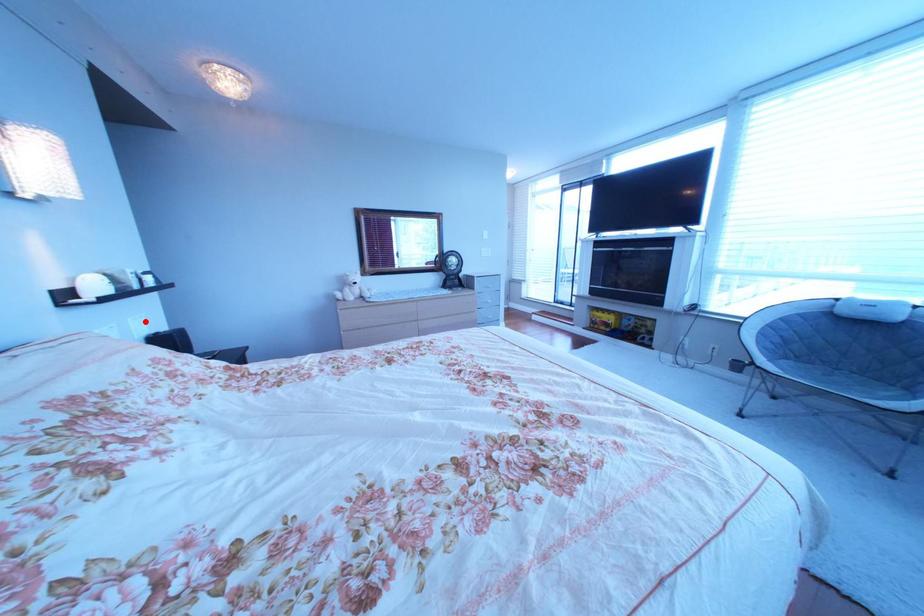
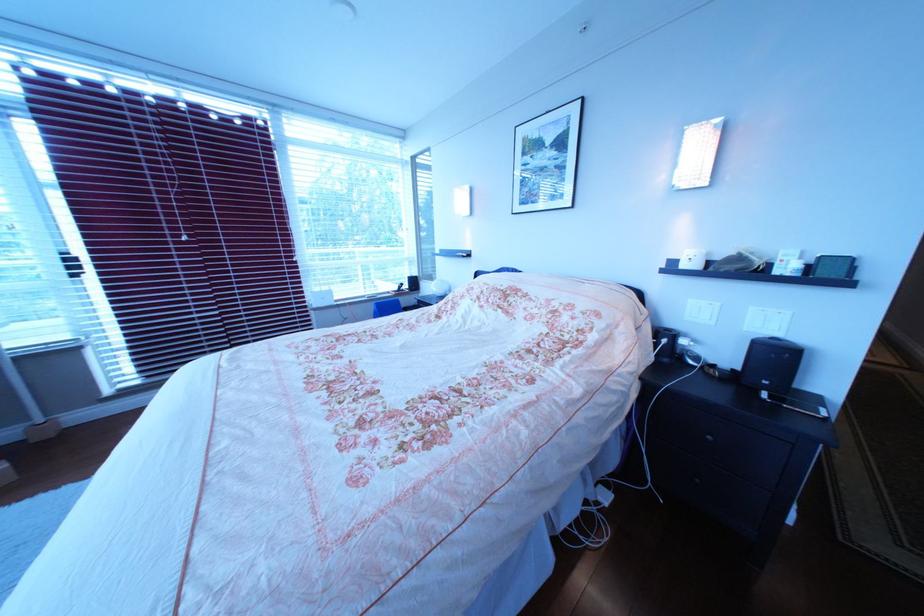
In the second image, find the point that corresponds to the highlighted location in the first image.

(767, 310)